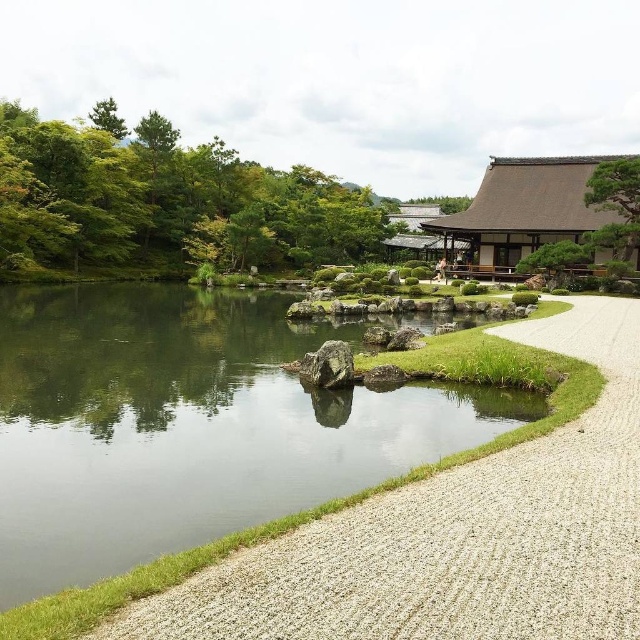
What do you see at coordinates (524, 211) in the screenshot? This screenshot has height=640, width=640. I see `brown/wooden temple at upper center` at bounding box center [524, 211].

Does point (454, 232) come in front of point (620, 204)?

No, (454, 232) is behind (620, 204).

You are a GUI agent. You are given a task and a screenshot of the screen. Output one action in this format:
    pyautogui.click(x=<x>, y=<y>)
    Task: Click on the brown/wooden temple at upper center
    This screenshot has height=640, width=640.
    Given the screenshot: What is the action you would take?
    pyautogui.click(x=524, y=211)

Who is positioned more to the left, gravel at lower right or green textured tree at upper right?

From the viewer's perspective, gravel at lower right appears more on the left side.

Is gravel at lower right positioned behind green textured tree at upper right?

That is False.

Is point (280, 632) positioned in front of point (598, 170)?

That is True.

Identify the location of gravel at lower right. Image resolution: width=640 pixels, height=640 pixels. (456, 534).

Which is behind, point (541, 481) or point (586, 193)?

Point (586, 193)

Can you confirm if gravel at lower right is positioned to the left of brown/wooden temple at upper center?

Yes, gravel at lower right is to the left of brown/wooden temple at upper center.

The height and width of the screenshot is (640, 640). Describe the element at coordinates (456, 534) in the screenshot. I see `gravel at lower right` at that location.

Image resolution: width=640 pixels, height=640 pixels. Identify the location of gravel at lower right. (456, 534).